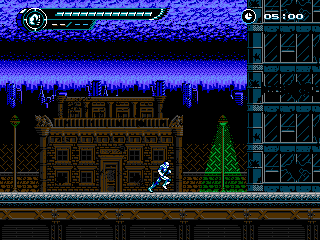
The width and height of the screenshot is (320, 240). What are the coordinates of `black ceiling in second part of gif` in the screenshot? It's located at (203, 18).